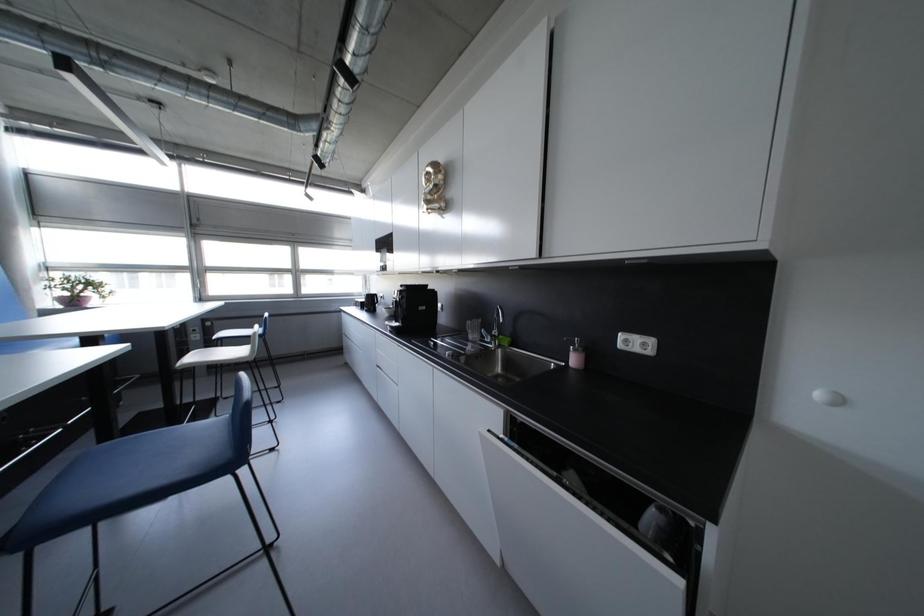
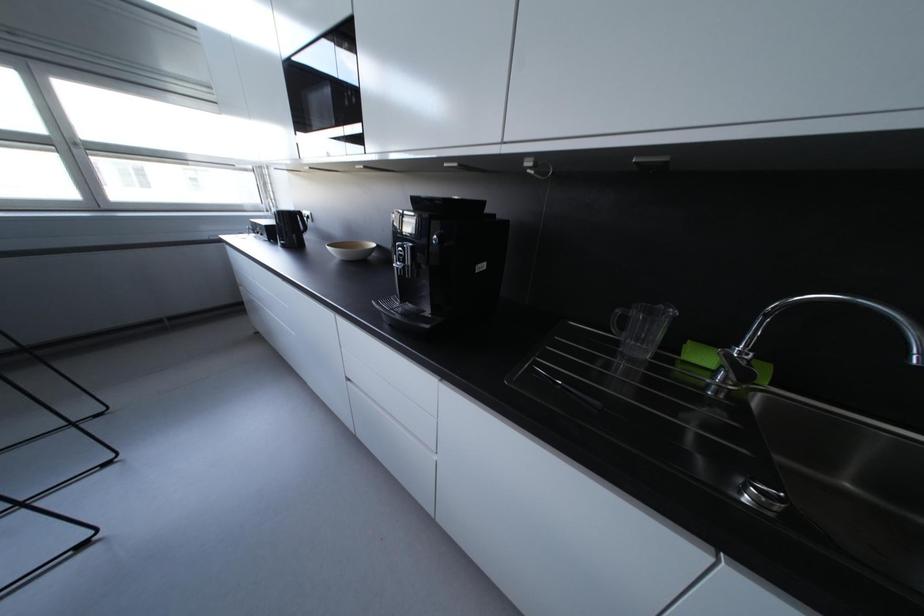
In a continuous first-person perspective shot, in which direction is the camera moving?

The movement direction of the cameraman is left, forward.